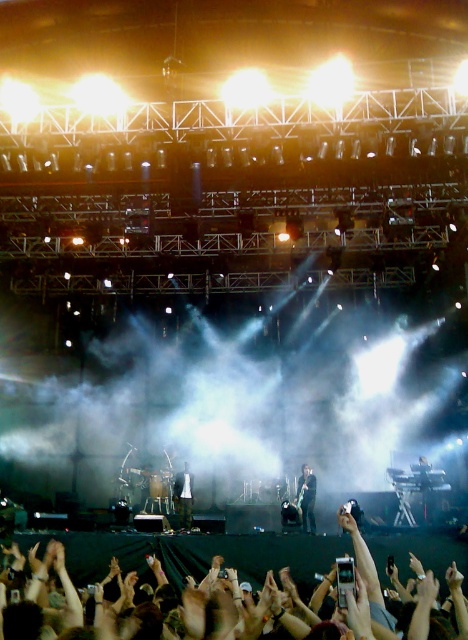
Question: Which of the following is the farthest from the observer?

Choices:
 (A) (300, 477)
 (B) (175, 484)

Answer: (A)

Question: Does shiny black jacket at center appear under matte black guitar at center?

Choices:
 (A) no
 (B) yes

Answer: (A)

Question: Is shiny black jacket at center below matte black guitar at center?

Choices:
 (A) no
 (B) yes

Answer: (A)

Question: Which point is farther to the camera?

Choices:
 (A) matte black guitar at center
 (B) shiny black jacket at center

Answer: (A)

Question: Can you confirm if shiny black jacket at center is positioned to the left of matte black guitar at center?

Choices:
 (A) yes
 (B) no

Answer: (B)